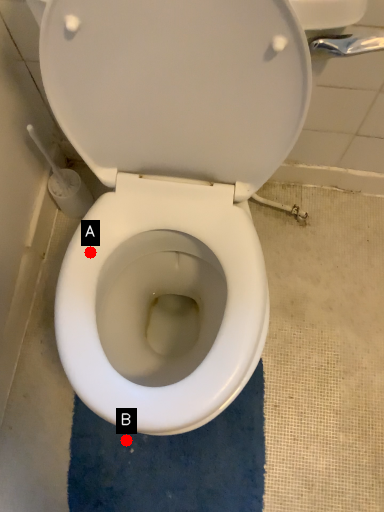
Question: Two points are circled on the image, labeled by A and B beside each circle. Which point appears farthest from the camera in this image?

Choices:
 (A) A is further
 (B) B is further

Answer: (B)